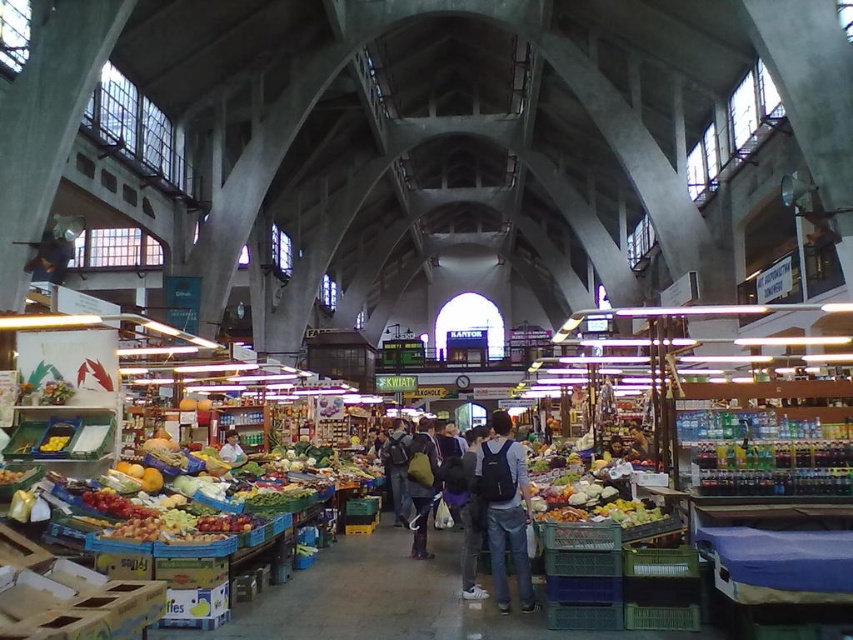
You are standing in the center of the market and see both the denim jacket at center and the dark gray backpack at center. Which item is positioned more to the right?

The denim jacket at center is positioned to the right of the dark gray backpack at center, so the denim jacket at center is more to the right.

You are a customer browsing jackets in the market. You see a denim jacket at center and a light brown leather jacket at center. Which jacket is positioned higher on the rack?

The denim jacket at center is located above the light brown leather jacket at center, so it is positioned higher on the rack.

You are a customer browsing jackets in the market. You see a denim jacket at center and a light brown leather jacket at center. Which jacket is taller?

The denim jacket at center is taller than the light brown leather jacket at center.